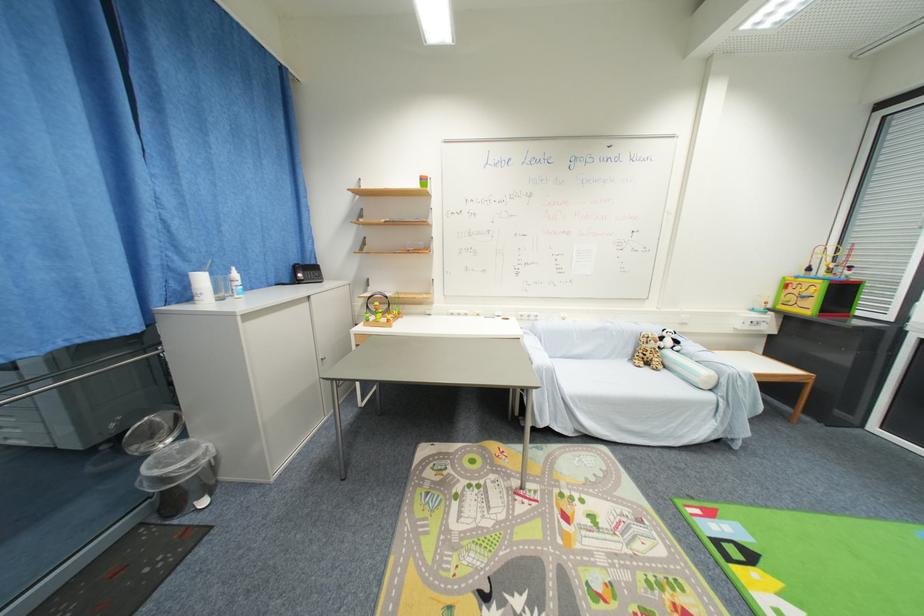
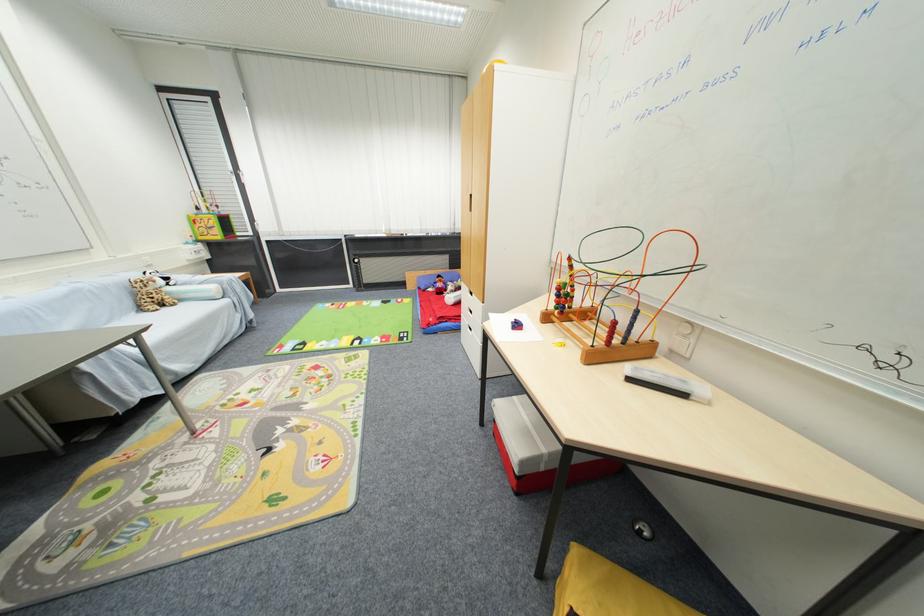
Locate, in the second image, the point that corresponds to point 811,310 in the first image.

(223, 238)